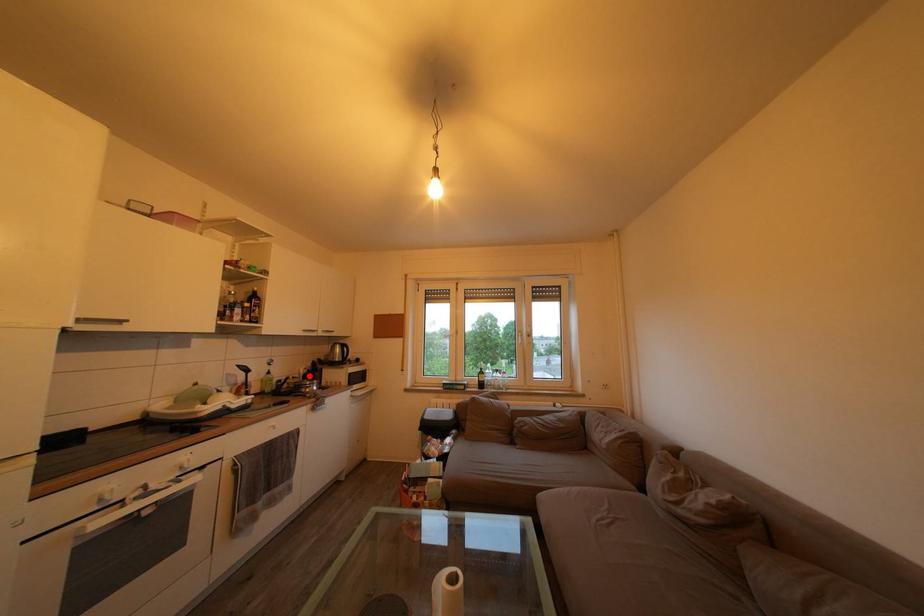
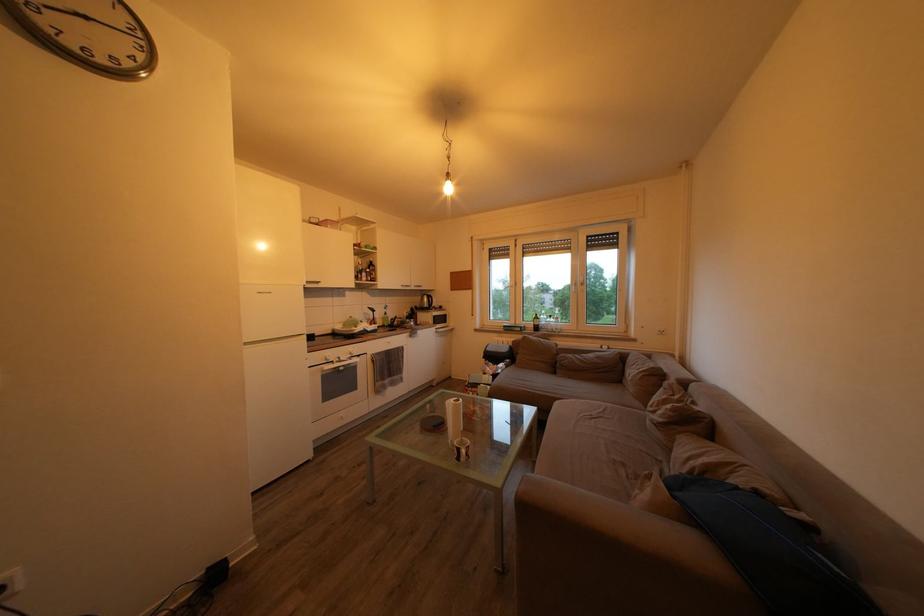
The point at the highlighted location is marked in the first image. Where is the corresponding point in the second image?

(412, 318)